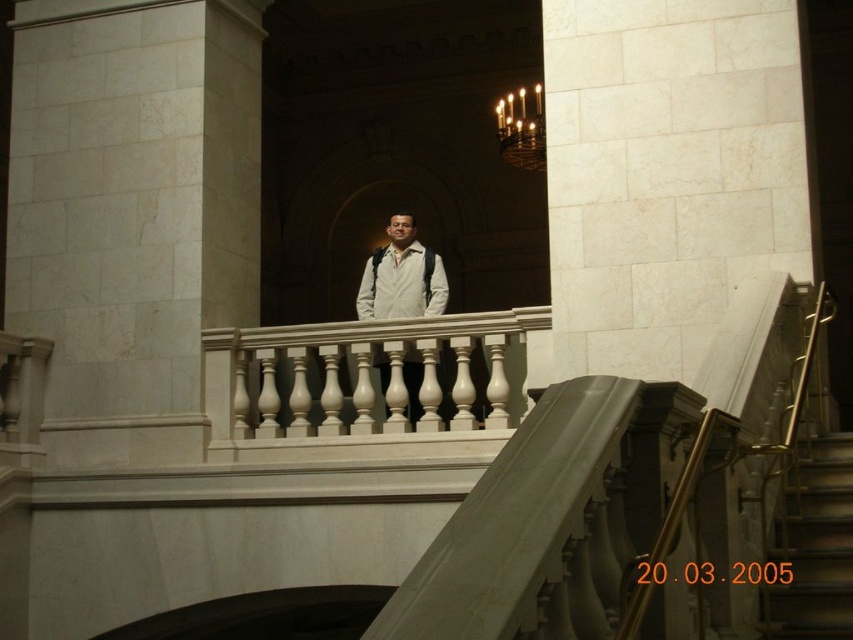
Question: Which is farther from the dark brown wooden stairs at lower right?

Choices:
 (A) matte white jacket at center
 (B) white marble balustrade at center
 (C) metallic gold chandelier at upper center
 (D) white marble pillar at center

Answer: (C)

Question: Is white marble balustrade at center thinner than matte white jacket at center?

Choices:
 (A) no
 (B) yes

Answer: (A)

Question: Does white marble pillar at center have a smaller size compared to dark brown wooden stairs at lower right?

Choices:
 (A) yes
 (B) no

Answer: (B)

Question: Which point is farther to the camera?

Choices:
 (A) white marble pillar at center
 (B) matte white jacket at center

Answer: (A)

Question: Is dark brown wooden stairs at lower right positioned in front of matte white jacket at center?

Choices:
 (A) no
 (B) yes

Answer: (B)

Question: Which point appears closest to the camera in this image?

Choices:
 (A) (167, 253)
 (B) (389, 381)
 (C) (393, 294)
 (D) (849, 518)

Answer: (D)